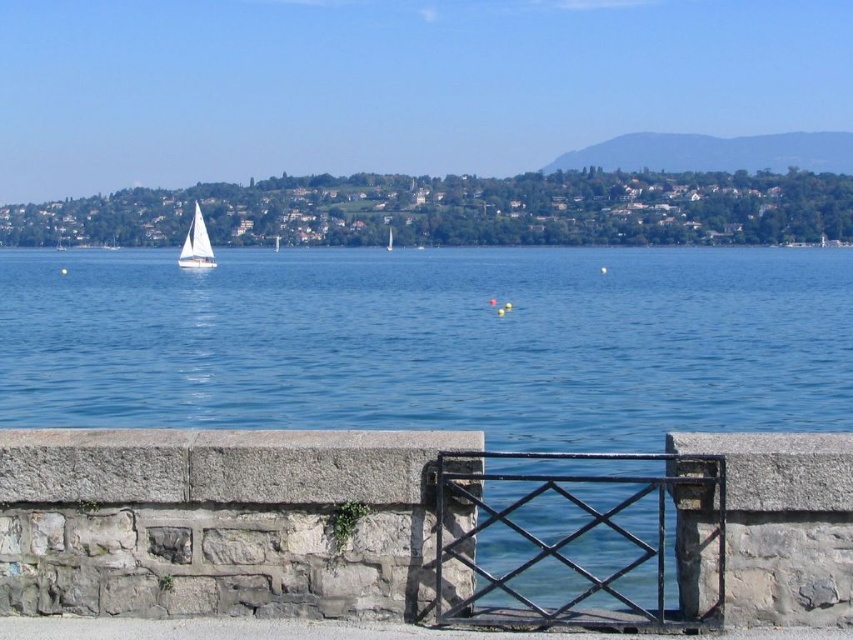
Does blue water at center appear on the right side of white sailboat at left?

Correct, you'll find blue water at center to the right of white sailboat at left.

Can you confirm if blue water at center is shorter than white sailboat at left?

In fact, blue water at center may be taller than white sailboat at left.

Is point (405, 292) closer to viewer compared to point (194, 220)?

Yes.

Where is `blue water at center`? Image resolution: width=853 pixels, height=640 pixels. blue water at center is located at coordinates (433, 340).

Which of these two, blue water at center or white matte sailboat at center, stands shorter?

white matte sailboat at center is shorter.

Who is more distant from viewer, (529, 376) or (387, 237)?

Point (387, 237)

Locate an element on the screen. blue water at center is located at coordinates (433, 340).

Is point (589, 557) positioned before point (390, 228)?

Yes, point (589, 557) is in front of point (390, 228).

Does black wrought iron gate at center have a greater height compared to white matte sailboat at center?

No, black wrought iron gate at center is not taller than white matte sailboat at center.

Does point (666, 456) lie in front of point (389, 250)?

Yes, point (666, 456) is in front of point (389, 250).

Where is `black wrought iron gate at center`? The width and height of the screenshot is (853, 640). black wrought iron gate at center is located at coordinates (570, 538).